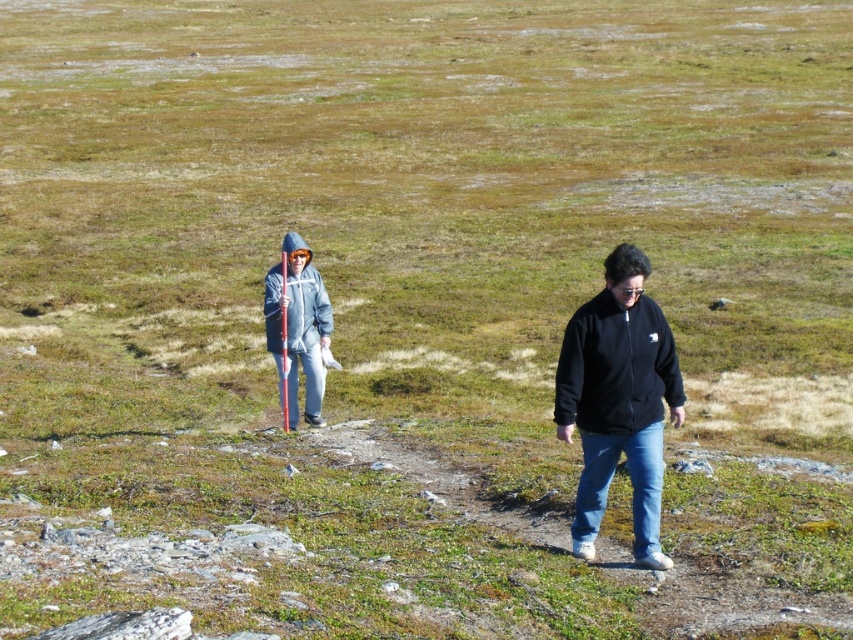
You are a photographer trying to capture both the black fleece sweatshirt at center and the matte gray jacket at center in a single frame. Which clothing item should you focus on first to ensure both are in the shot?

The black fleece sweatshirt at center is much taller than the matte gray jacket at center, so you should focus on the black fleece sweatshirt at center first to ensure both are in the shot.

You are a photographer standing at the origin point of the coordinate system. You want to take a photo of the black matte jacket at center. What are the coordinates where you should aim your camera?

The coordinates to aim your camera are at point (618, 401).